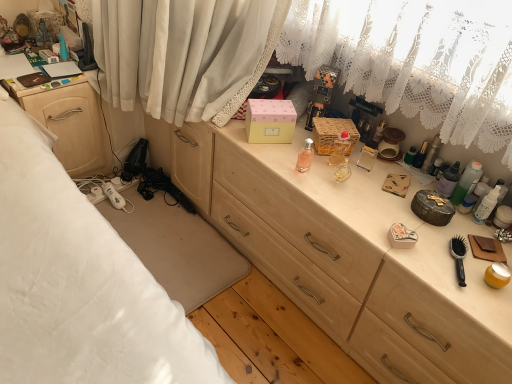
You are a GUI agent. You are given a task and a screenshot of the screen. Output one action in this format:
    pyautogui.click(x=<x>, y=<y>)
    Task: Click on the vacant region in front of pink matte box at center
    Image resolution: width=512 pixels, height=384 pixels.
    Given the screenshot: What is the action you would take?
    pyautogui.click(x=266, y=153)